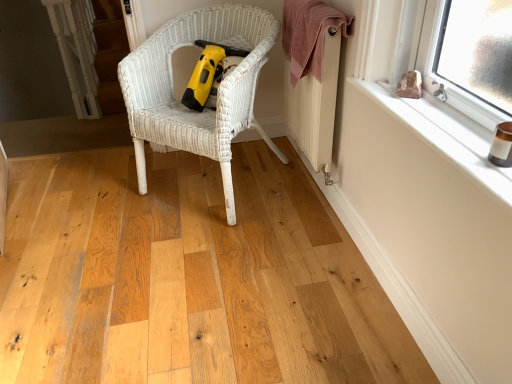
The image size is (512, 384). Identify the location of vacant region below white wicker chair at center (from a real-world perspective). (196, 188).